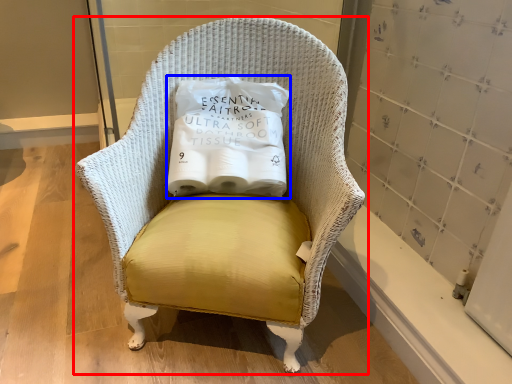
Question: Which point is further to the camera, chair (highlighted by a red box) or pillow (highlighted by a blue box)?

Choices:
 (A) chair
 (B) pillow

Answer: (B)